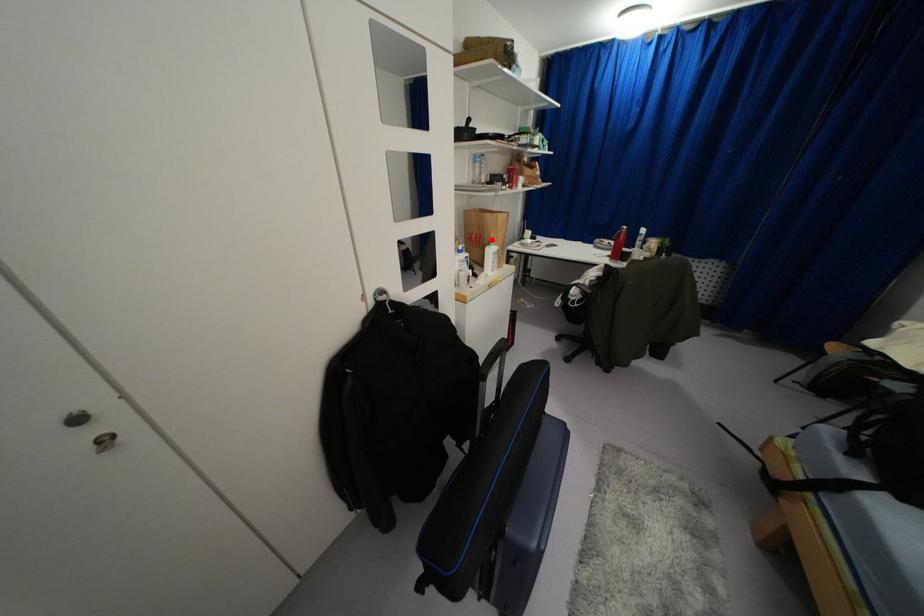
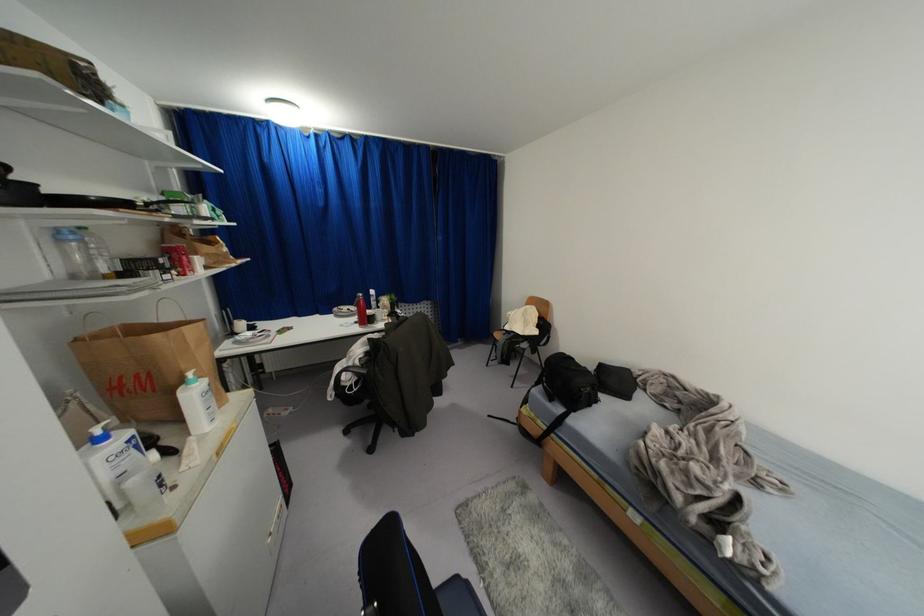
The point at the highlighted location is marked in the first image. Where is the corresponding point in the second image?

(189, 374)